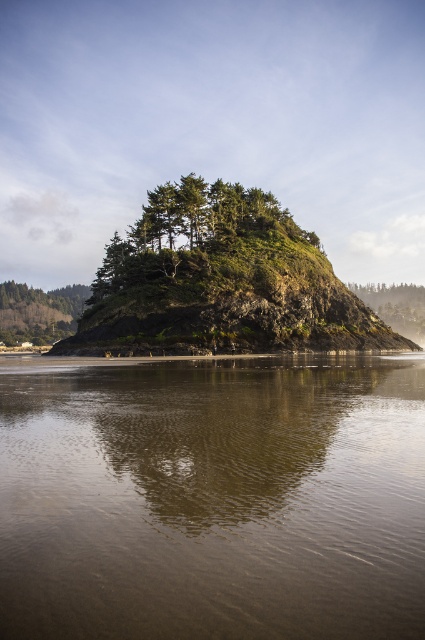
You are a photographer planning to capture the island in the image. You notice the brown reflective water at center and the foggy mist at upper center. Which of these elements has a narrower width when viewed from your current position?

The brown reflective water at center is thinner than the foggy mist at upper center, so the brown reflective water at center has a narrower width.

You are an explorer on a boat approaching the island. You notice the foggy mist at upper center and the green matte tree at left. Which object appears taller from your vantage point?

The foggy mist at upper center appears taller than the green matte tree at left because it is much taller as described.

You are standing on the island and want to take a photo of the green matte tree at left and the brown reflective water at center. Which object should you frame first in your camera viewfinder to ensure both are in the shot?

You should frame the green matte tree at left first because the brown reflective water at center is to the right of it, so positioning the tree on the left side of the viewfinder will allow the water to naturally fall into the right side of the frame.